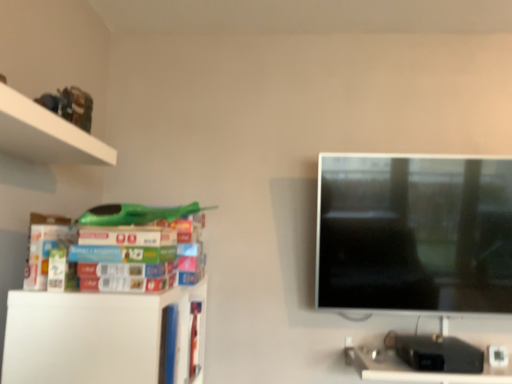
Question: Visually, is black plastic computer desk at lower right positioned to the left or to the right of white matte shelf at lower left?

Choices:
 (A) left
 (B) right

Answer: (B)

Question: Is point (376, 379) positioned closer to the camera than point (157, 309)?

Choices:
 (A) closer
 (B) farther

Answer: (B)

Question: Which object is positioned farthest from the matte plastic books at left?

Choices:
 (A) white matte shelf at lower left
 (B) black plastic computer desk at lower right

Answer: (B)

Question: Based on their relative distances, which object is farther from the matte plastic books at left?

Choices:
 (A) white matte shelf at lower left
 (B) black plastic computer desk at lower right

Answer: (B)